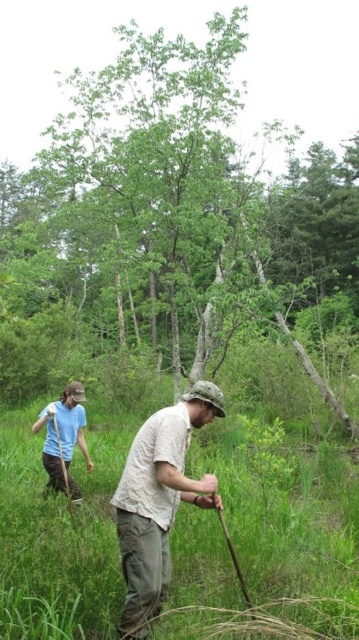
You are standing at the origin point of the image. Which direction should you move to reach the green leafy tree at center?

The green leafy tree at center is located at coordinates 0.333 on the x axis and 0.485 on the y axis, so you should move towards the center of the image to reach it.

Based on the photo, you are standing in the middle of the scene and want to walk towards the green grassy at center. Which direction should you move relative to the green leafy tree at center?

To reach the green grassy at center, you should move to the right of the green leafy tree at center since it is positioned to the left of the green grassy at center.

You are a hiker trying to take a photo of the green leafy tree at center and the beige cotton shirt at center. Which object should you focus on first if you want both to be in sharp focus?

You should focus on the green leafy tree at center first because it is taller than the beige cotton shirt at center, so focusing on the farther object ensures both will be in focus.